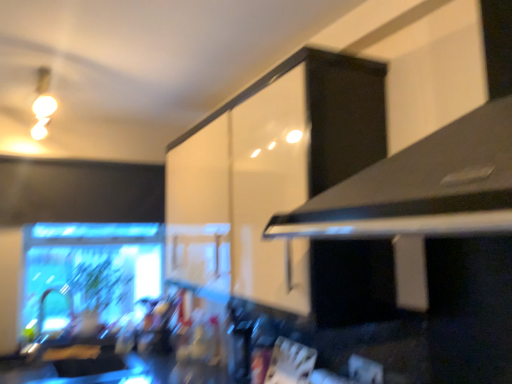
Question: From the image's perspective, does matte white bulb at upper left appear lower than white glossy cabinet at upper center?

Choices:
 (A) yes
 (B) no

Answer: (B)

Question: Considering the relative sizes of matte white bulb at upper left and white glossy cabinet at upper center in the image provided, is matte white bulb at upper left bigger than white glossy cabinet at upper center?

Choices:
 (A) yes
 (B) no

Answer: (B)

Question: Would you say matte white bulb at upper left is outside white glossy cabinet at upper center?

Choices:
 (A) no
 (B) yes

Answer: (B)

Question: Can you confirm if matte white bulb at upper left is wider than white glossy cabinet at upper center?

Choices:
 (A) no
 (B) yes

Answer: (B)

Question: Would you say matte white bulb at upper left contains white glossy cabinet at upper center?

Choices:
 (A) no
 (B) yes

Answer: (A)

Question: Is matte white bulb at upper left at the right side of white glossy cabinet at upper center?

Choices:
 (A) no
 (B) yes

Answer: (A)

Question: Would you say white glossy cabinet at upper center is part of black matte exhaust hood at upper right's contents?

Choices:
 (A) yes
 (B) no

Answer: (B)

Question: Is black matte exhaust hood at upper right facing towards white glossy cabinet at upper center?

Choices:
 (A) yes
 (B) no

Answer: (B)

Question: Can we say black matte exhaust hood at upper right lies outside white glossy cabinet at upper center?

Choices:
 (A) no
 (B) yes

Answer: (B)

Question: Considering the relative sizes of black matte exhaust hood at upper right and white glossy cabinet at upper center in the image provided, is black matte exhaust hood at upper right thinner than white glossy cabinet at upper center?

Choices:
 (A) yes
 (B) no

Answer: (B)

Question: Would you consider black matte exhaust hood at upper right to be distant from white glossy cabinet at upper center?

Choices:
 (A) no
 (B) yes

Answer: (A)

Question: Is black matte exhaust hood at upper right further to camera compared to white glossy cabinet at upper center?

Choices:
 (A) yes
 (B) no

Answer: (B)

Question: From the image's perspective, would you say white glossy cabinet at upper center is positioned over matte white bulb at upper left?

Choices:
 (A) yes
 (B) no

Answer: (B)